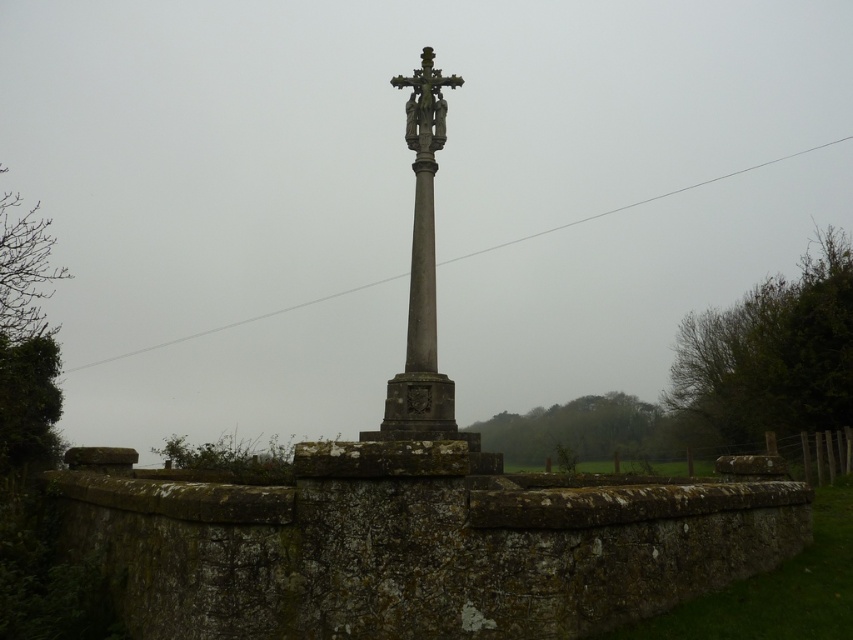
Question: Which of the following is the closest to the observer?

Choices:
 (A) (422, 208)
 (B) (408, 138)

Answer: (A)

Question: Does gray stone cross at center appear on the right side of dark gray stone crucifix at center?

Choices:
 (A) no
 (B) yes

Answer: (B)

Question: Where is gray stone cross at center located in relation to dark gray stone crucifix at center in the image?

Choices:
 (A) below
 (B) above

Answer: (A)

Question: Does gray stone cross at center have a larger size compared to dark gray stone crucifix at center?

Choices:
 (A) yes
 (B) no

Answer: (A)